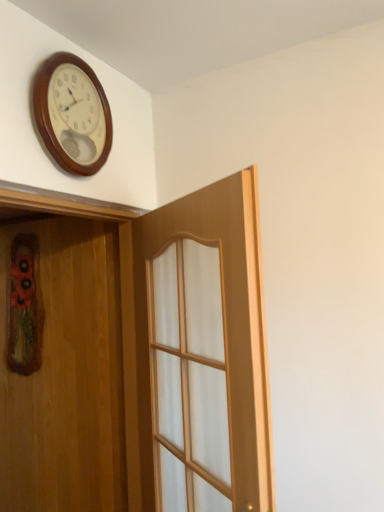
The width and height of the screenshot is (384, 512). I want to click on wooden wall clock at upper left, so click(72, 114).

Which of these two, wooden door at left, the 1th door in the left-to-right sequence, or light wood door at center, acting as the second door starting from the left, is wider?

light wood door at center, acting as the second door starting from the left, is wider.

Is point (55, 458) behind point (2, 262)?

No, (55, 458) is closer to viewer.

In the image, is wooden door at left, the 1th door in the left-to-right sequence, on the left side or the right side of light wood door at center, which is counted as the first door, starting from the right?

In the image, wooden door at left, the 1th door in the left-to-right sequence, appears on the left side of light wood door at center, which is counted as the first door, starting from the right.

Is wooden door at left, the 1th door in the left-to-right sequence, positioned with its back to light wood door at center, which is counted as the first door, starting from the right?

Yes.

Is point (85, 413) behind point (94, 103)?

Yes, it is.

The height and width of the screenshot is (512, 384). In order to click on wall clock above the wooden door at left, the 1th door in the left-to-right sequence (from the image's perspective) in this screenshot , I will do `click(72, 114)`.

Could you tell me if wooden door at left, placed as the 2th door when sorted from right to left, is facing wooden wall clock at upper left?

No, wooden door at left, placed as the 2th door when sorted from right to left, is not turned towards wooden wall clock at upper left.

From a real-world perspective, relative to wooden wall clock at upper left, is wooden door at left, the 1th door in the left-to-right sequence, vertically above or below?

From a real-world perspective, wooden door at left, the 1th door in the left-to-right sequence, is physically below wooden wall clock at upper left.

Consider the image. Is wooden wall clock at upper left looking in the opposite direction of light wood door at center, which is counted as the first door, starting from the right?

No.

Is point (52, 153) closer or farther from the camera than point (179, 204)?

Point (52, 153) appears to be closer to the viewer than point (179, 204).

Considering the relative sizes of wooden wall clock at upper left and light wood door at center, acting as the second door starting from the left, in the image provided, is wooden wall clock at upper left shorter than light wood door at center, acting as the second door starting from the left,?

Yes.

Can we say wooden wall clock at upper left lies outside light wood door at center, acting as the second door starting from the left?

wooden wall clock at upper left lies outside light wood door at center, acting as the second door starting from the left,'s area.

Considering the sizes of wooden wall clock at upper left and wooden door at left, placed as the 2th door when sorted from right to left, in the image, is wooden wall clock at upper left wider or thinner than wooden door at left, placed as the 2th door when sorted from right to left,?

Considering their sizes, wooden wall clock at upper left looks slimmer than wooden door at left, placed as the 2th door when sorted from right to left.

In the scene shown: Is wooden wall clock at upper left shorter than wooden door at left, placed as the 2th door when sorted from right to left?

Correct, wooden wall clock at upper left is not as tall as wooden door at left, placed as the 2th door when sorted from right to left.

From a real-world perspective, which object rests below the other?

In real-world perspective, wooden door at left, the 1th door in the left-to-right sequence, is lower.

Does point (83, 108) come closer to viewer compared to point (77, 356)?

Yes.

You are a GUI agent. You are given a task and a screenshot of the screen. Output one action in this format:
    pyautogui.click(x=<x>, y=<y>)
    Task: Click on the door behind the light wood door at center, acting as the second door starting from the left
    The width and height of the screenshot is (384, 512).
    Given the screenshot: What is the action you would take?
    pyautogui.click(x=66, y=376)

Is light wood door at center, acting as the second door starting from the left, far from wooden door at left, the 1th door in the left-to-right sequence?

No, light wood door at center, acting as the second door starting from the left, is not far away from wooden door at left, the 1th door in the left-to-right sequence.

Considering the relative sizes of light wood door at center, which is counted as the first door, starting from the right, and wooden door at left, placed as the 2th door when sorted from right to left, in the image provided, is light wood door at center, which is counted as the first door, starting from the right, shorter than wooden door at left, placed as the 2th door when sorted from right to left,?

Yes.

Would you say light wood door at center, which is counted as the first door, starting from the right, is to the left or to the right of wooden door at left, placed as the 2th door when sorted from right to left, in the picture?

Clearly, light wood door at center, which is counted as the first door, starting from the right, is on the right of wooden door at left, placed as the 2th door when sorted from right to left, in the image.

In the scene shown: Can you confirm if light wood door at center, acting as the second door starting from the left, is shorter than wooden wall clock at upper left?

In fact, light wood door at center, acting as the second door starting from the left, may be taller than wooden wall clock at upper left.

Based on the photo, does light wood door at center, which is counted as the first door, starting from the right, have a lesser width compared to wooden wall clock at upper left?

No.

Is point (131, 437) closer to viewer compared to point (44, 126)?

No, it is behind (44, 126).

Which is in front, light wood door at center, which is counted as the first door, starting from the right, or wooden wall clock at upper left?

Positioned in front is light wood door at center, which is counted as the first door, starting from the right.

Identify the location of door that appears above the light wood door at center, which is counted as the first door, starting from the right (from a real-world perspective). The image size is (384, 512). (66, 376).

Identify the location of wall clock on the right of wooden door at left, the 1th door in the left-to-right sequence. The height and width of the screenshot is (512, 384). (72, 114).

Looking at the image, which one is located further to light wood door at center, acting as the second door starting from the left, wooden door at left, the 1th door in the left-to-right sequence, or wooden wall clock at upper left?

wooden wall clock at upper left is positioned further to the anchor light wood door at center, acting as the second door starting from the left.

When comparing their distances from wooden door at left, the 1th door in the left-to-right sequence, does light wood door at center, which is counted as the first door, starting from the right, or wooden wall clock at upper left seem closer?

light wood door at center, which is counted as the first door, starting from the right, is positioned closer to the anchor wooden door at left, the 1th door in the left-to-right sequence.

Estimate the real-world distances between objects in this image. Which object is closer to light wood door at center, acting as the second door starting from the left, wooden wall clock at upper left or wooden door at left, placed as the 2th door when sorted from right to left?

Based on the image, wooden door at left, placed as the 2th door when sorted from right to left, appears to be nearer to light wood door at center, acting as the second door starting from the left.

Estimate the real-world distances between objects in this image. Which object is closer to wooden wall clock at upper left, wooden door at left, placed as the 2th door when sorted from right to left, or light wood door at center, which is counted as the first door, starting from the right?

light wood door at center, which is counted as the first door, starting from the right, lies closer to wooden wall clock at upper left than the other object.

Which object lies further to the anchor point wooden wall clock at upper left, light wood door at center, acting as the second door starting from the left, or wooden door at left, placed as the 2th door when sorted from right to left?

wooden door at left, placed as the 2th door when sorted from right to left, is positioned further to the anchor wooden wall clock at upper left.

Looking at the image, which one is located further to wooden door at left, the 1th door in the left-to-right sequence, wooden wall clock at upper left or light wood door at center, acting as the second door starting from the left?

wooden wall clock at upper left lies further to wooden door at left, the 1th door in the left-to-right sequence, than the other object.

The height and width of the screenshot is (512, 384). I want to click on door that lies between wooden wall clock at upper left and wooden door at left, placed as the 2th door when sorted from right to left, from top to bottom, so click(135, 359).